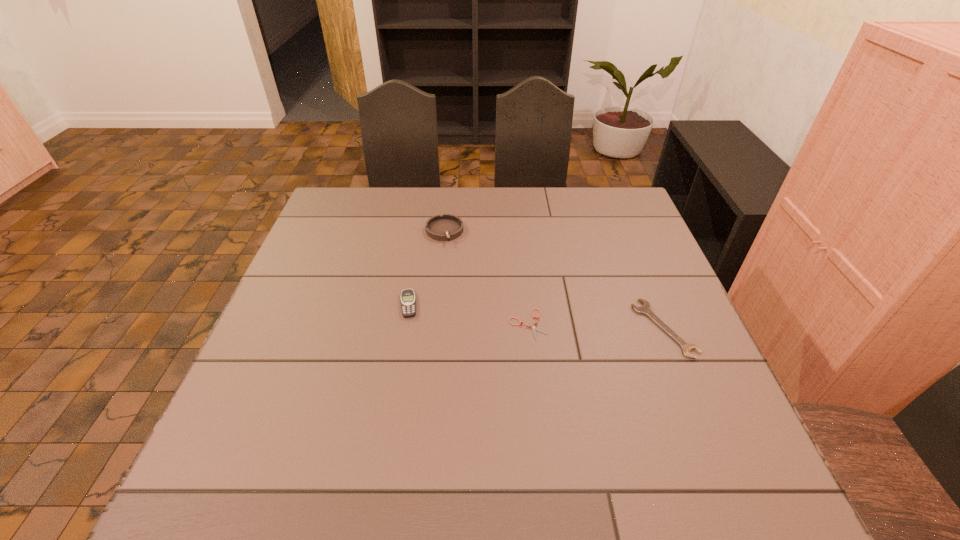
The height and width of the screenshot is (540, 960). Identify the location of vacant space that is in between the shortest object and the ashtray. (486, 278).

This screenshot has width=960, height=540. I want to click on empty space between the rightmost object and the shortest object, so click(x=595, y=326).

Locate an element on the screen. The height and width of the screenshot is (540, 960). vacant region between the ashtray and the second shortest object is located at coordinates (554, 280).

Where is `free space that is in between the third tallest object and the second tallest object`? The image size is (960, 540). free space that is in between the third tallest object and the second tallest object is located at coordinates (537, 316).

The image size is (960, 540). Identify the location of blank region between the shears and the ashtray. (486, 278).

Where is `free area in between the tallest object and the beeper`? free area in between the tallest object and the beeper is located at coordinates (426, 268).

Identify the location of free space between the ashtray and the shortest object. The width and height of the screenshot is (960, 540). [x=486, y=278].

This screenshot has height=540, width=960. What are the coordinates of `free space that is in between the rightmost object and the third shortest object` in the screenshot? It's located at (537, 316).

Find the location of a particular element. free spot between the ashtray and the third tallest object is located at coordinates (554, 280).

Where is `vacant area that lies between the second shortest object and the ashtray`? This screenshot has width=960, height=540. vacant area that lies between the second shortest object and the ashtray is located at coordinates (554, 280).